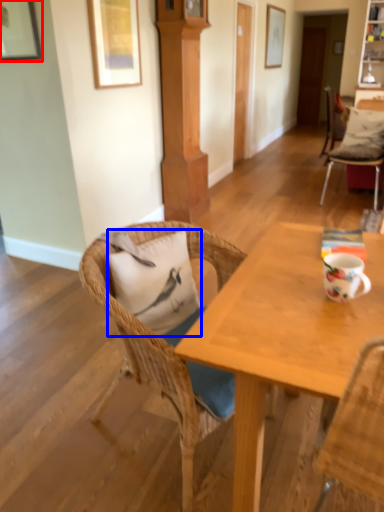
Question: Among these objects, which one is nearest to the camera, picture frame (highlighted by a red box) or pillow (highlighted by a blue box)?

Choices:
 (A) picture frame
 (B) pillow

Answer: (B)